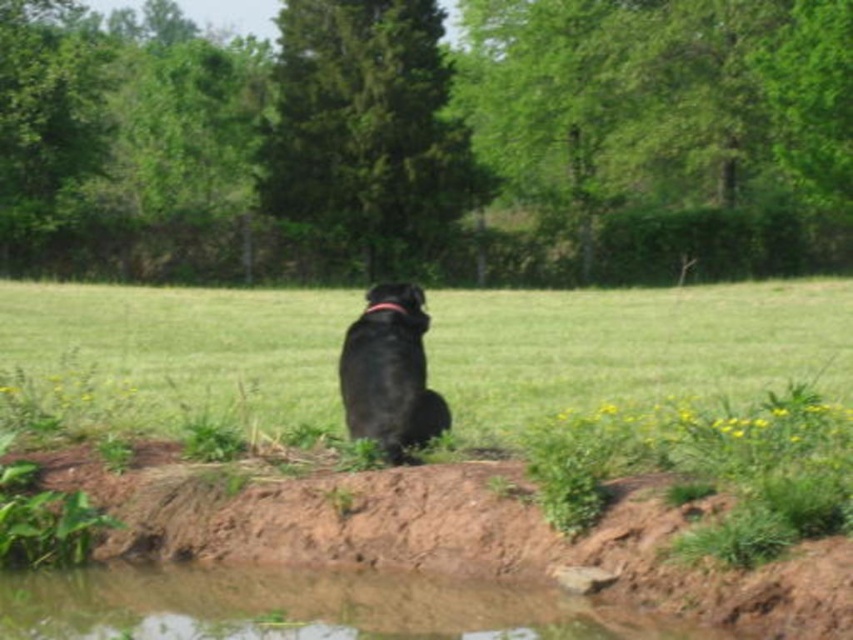
Is clear water at lower center positioned in front of black matte dog at center?

Yes.

How far apart are clear water at lower center and black matte dog at center?

clear water at lower center and black matte dog at center are 1.83 meters apart from each other.

The width and height of the screenshot is (853, 640). What are the coordinates of `clear water at lower center` in the screenshot? It's located at (299, 605).

Who is more distant from viewer, (x=24, y=369) or (x=94, y=595)?

Point (x=24, y=369)

Looking at this image, can you confirm if green grass at center is positioned above clear water at lower center?

Yes.

Does point (131, 352) come behind point (303, 572)?

That is True.

The height and width of the screenshot is (640, 853). I want to click on green grass at center, so click(x=631, y=346).

Does green grass at center appear on the left side of black matte dog at center?

Indeed, green grass at center is positioned on the left side of black matte dog at center.

How far apart are green grass at center and black matte dog at center?

17.00 meters

Who is more forward, (672,384) or (393,420)?

Point (393,420) is in front.

Locate an element on the screen. green grass at center is located at coordinates (631, 346).